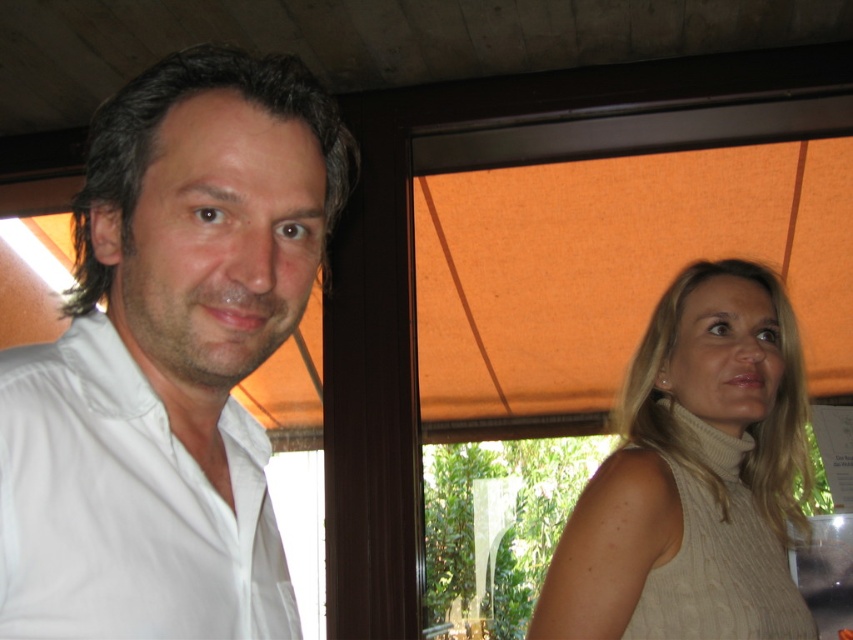
Question: Can you confirm if white smooth shirt at left is positioned above white cotton shirt at left?

Choices:
 (A) yes
 (B) no

Answer: (A)

Question: Which point appears closest to the camera in this image?

Choices:
 (A) (192, 504)
 (B) (635, 392)
 (C) (288, 186)

Answer: (C)

Question: Among these objects, which one is farthest from the camera?

Choices:
 (A) white smooth shirt at left
 (B) white cotton shirt at left
 (C) beige knitted sweater at right

Answer: (C)

Question: Which of these objects is positioned closest to the beige knitted sweater at right?

Choices:
 (A) white cotton shirt at left
 (B) white smooth shirt at left

Answer: (A)

Question: Is beige knitted sweater at right further to camera compared to white cotton shirt at left?

Choices:
 (A) yes
 (B) no

Answer: (A)

Question: Is white smooth shirt at left bigger than white cotton shirt at left?

Choices:
 (A) yes
 (B) no

Answer: (A)